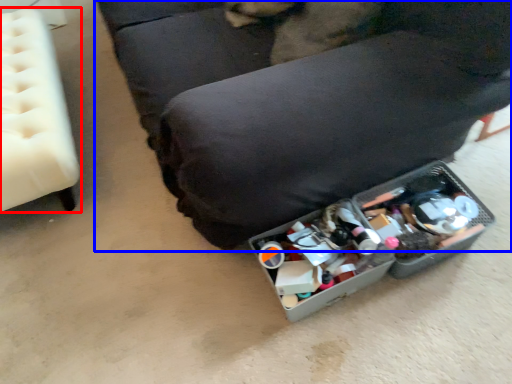
Question: Which of the following is the farthest to the observer, furniture (highlighted by a red box) or furniture (highlighted by a blue box)?

Choices:
 (A) furniture
 (B) furniture

Answer: (A)